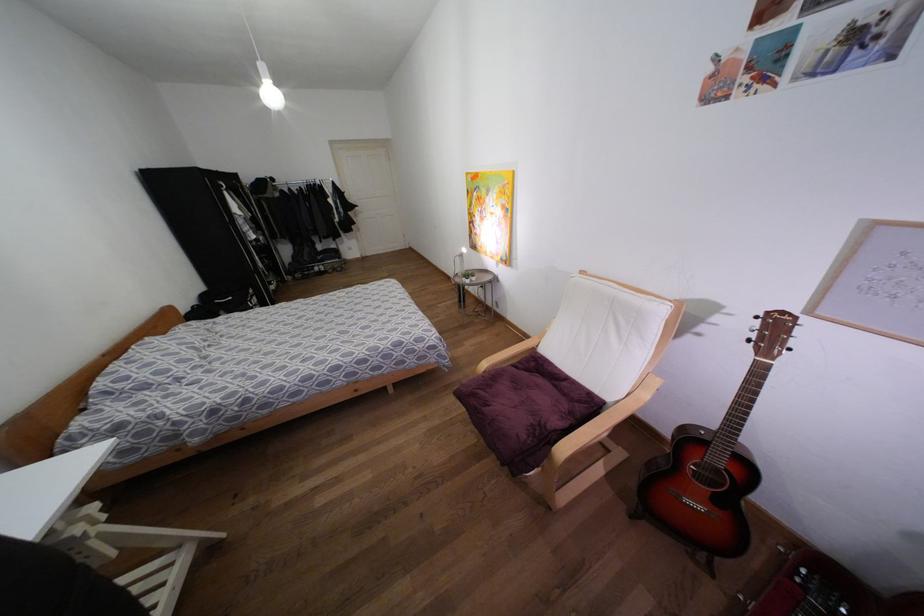
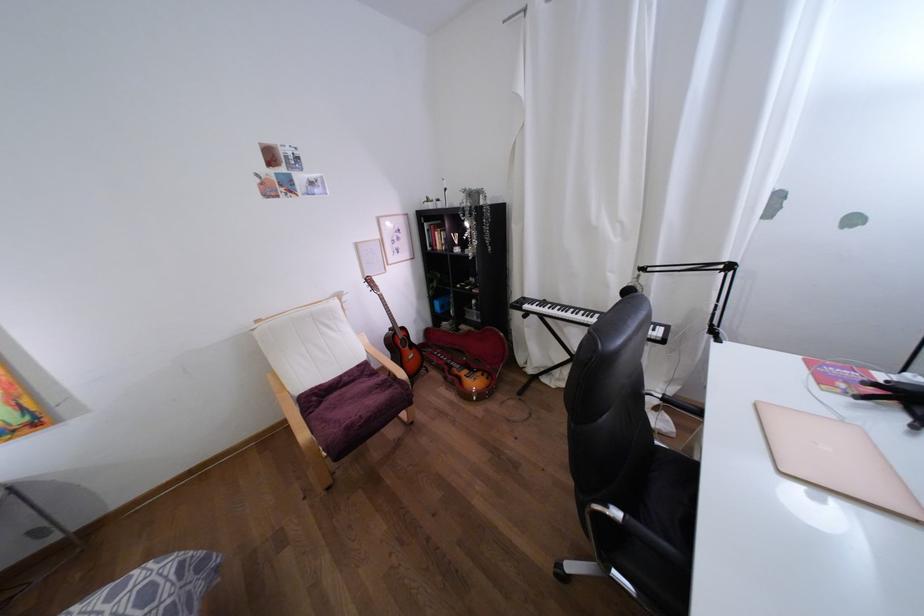
Where in the second image is the point corresponding to point (737, 450) from the first image?

(398, 325)